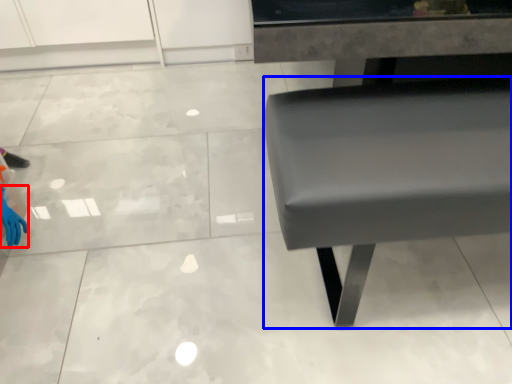
Question: Which point is further to the camera, hand (highlighted by a red box) or furniture (highlighted by a blue box)?

Choices:
 (A) hand
 (B) furniture

Answer: (A)